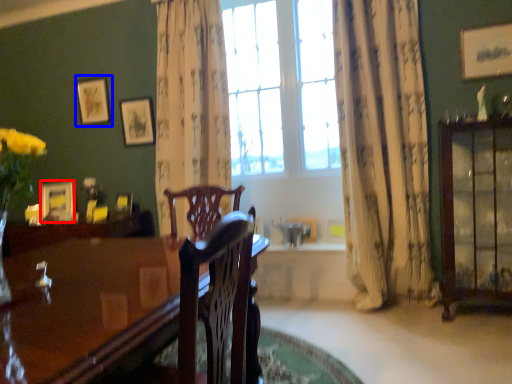
Question: Which of the following is the farthest to the observer, picture frame (highlighted by a red box) or picture frame (highlighted by a blue box)?

Choices:
 (A) picture frame
 (B) picture frame

Answer: (B)